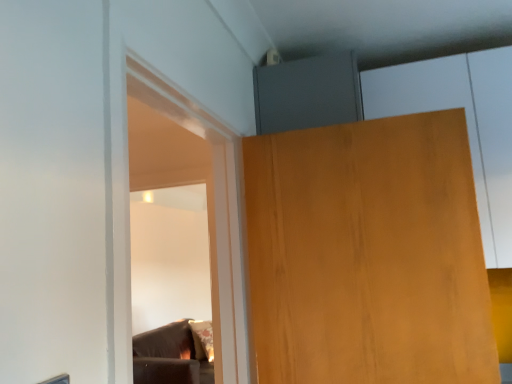
Describe the element at coordinates (467, 125) in the screenshot. I see `matte wood cabinet at upper right` at that location.

What is the approximate width of matte wood cabinet at upper right?

It is 14.46 inches.

Where is `matte wood cabinet at upper right`? The width and height of the screenshot is (512, 384). matte wood cabinet at upper right is located at coordinates coord(467,125).

You are a GUI agent. You are given a task and a screenshot of the screen. Output one action in this format:
    pyautogui.click(x=<x>, y=<y>)
    Task: Click on the wooden door at upper right
    The height and width of the screenshot is (384, 512).
    Given the screenshot: What is the action you would take?
    pyautogui.click(x=367, y=254)

Describe the element at coordinates (367, 254) in the screenshot. This screenshot has width=512, height=384. I see `wooden door at upper right` at that location.

At what (x,y) coordinates should I click in order to perform the action: click on matte wood cabinet at upper right. Please return your answer as a coordinate pair (x, y). This screenshot has width=512, height=384. Looking at the image, I should click on (467, 125).

Considering the positions of objects wooden door at upper right and matte wood cabinet at upper right in the image provided, who is more to the right, wooden door at upper right or matte wood cabinet at upper right?

matte wood cabinet at upper right is more to the right.

In the image, is wooden door at upper right positioned in front of or behind matte wood cabinet at upper right?

Clearly, wooden door at upper right is in front of matte wood cabinet at upper right.

Which is behind, point (473, 291) or point (499, 72)?

Point (499, 72)

From the image's perspective, between wooden door at upper right and matte wood cabinet at upper right, who is located below?

wooden door at upper right, from the image's perspective.

From a real-world perspective, which object rests below the other?

wooden door at upper right, from a real-world perspective.

Looking at their sizes, would you say wooden door at upper right is wider or thinner than matte wood cabinet at upper right?

Considering their sizes, wooden door at upper right looks slimmer than matte wood cabinet at upper right.

Can you confirm if wooden door at upper right is taller than matte wood cabinet at upper right?

Incorrect, the height of wooden door at upper right is not larger of that of matte wood cabinet at upper right.

From the picture: Considering the sizes of objects wooden door at upper right and matte wood cabinet at upper right in the image provided, who is bigger, wooden door at upper right or matte wood cabinet at upper right?

Bigger between the two is matte wood cabinet at upper right.

Is wooden door at upper right not inside matte wood cabinet at upper right?

wooden door at upper right is positioned outside matte wood cabinet at upper right.

Is wooden door at upper right far away from matte wood cabinet at upper right?

No, there isn't a large distance between wooden door at upper right and matte wood cabinet at upper right.

Consider the image. Is wooden door at upper right oriented towards matte wood cabinet at upper right?

No, wooden door at upper right is not aimed at matte wood cabinet at upper right.

How different are the orientations of wooden door at upper right and matte wood cabinet at upper right in degrees?

wooden door at upper right and matte wood cabinet at upper right are facing 5.01 degrees away from each other.

How distant is wooden door at upper right from matte wood cabinet at upper right?

54.65 centimeters.

At what (x,y) coordinates should I click in order to perform the action: click on cabinetry on the right of wooden door at upper right. Please return your answer as a coordinate pair (x, y). The width and height of the screenshot is (512, 384). Looking at the image, I should click on (467, 125).

Would you say matte wood cabinet at upper right is to the left or to the right of wooden door at upper right in the picture?

Based on their positions, matte wood cabinet at upper right is located to the right of wooden door at upper right.

Between matte wood cabinet at upper right and wooden door at upper right, which one is positioned behind?

matte wood cabinet at upper right.

Considering the positions of points (480, 148) and (452, 336), is point (480, 148) closer to camera compared to point (452, 336)?

No, (480, 148) is behind (452, 336).

From the image's perspective, which is above, matte wood cabinet at upper right or wooden door at upper right?

matte wood cabinet at upper right, from the image's perspective.

Looking at this image, from a real-world perspective, which object stands above the other?

matte wood cabinet at upper right is physically above.

Considering the sizes of matte wood cabinet at upper right and wooden door at upper right in the image, is matte wood cabinet at upper right wider or thinner than wooden door at upper right?

matte wood cabinet at upper right is wider than wooden door at upper right.

Does matte wood cabinet at upper right have a lesser height compared to wooden door at upper right?

No.

Does matte wood cabinet at upper right have a smaller size compared to wooden door at upper right?

Incorrect, matte wood cabinet at upper right is not smaller in size than wooden door at upper right.

Is matte wood cabinet at upper right not inside wooden door at upper right?

matte wood cabinet at upper right is positioned outside wooden door at upper right.

Are matte wood cabinet at upper right and wooden door at upper right far apart?

No.

Is matte wood cabinet at upper right positioned with its back to wooden door at upper right?

matte wood cabinet at upper right is not turned away from wooden door at upper right.

How different are the orientations of matte wood cabinet at upper right and wooden door at upper right in degrees?

5.01 degrees separate the facing orientations of matte wood cabinet at upper right and wooden door at upper right.

Locate an element on the screen. cabinetry located above the wooden door at upper right (from a real-world perspective) is located at coordinates (467, 125).

Where is `cabinetry above the wooden door at upper right (from a real-world perspective)`? This screenshot has height=384, width=512. cabinetry above the wooden door at upper right (from a real-world perspective) is located at coordinates (467, 125).

Where is `cabinetry above the wooden door at upper right (from the image's perspective)`? cabinetry above the wooden door at upper right (from the image's perspective) is located at coordinates (467, 125).